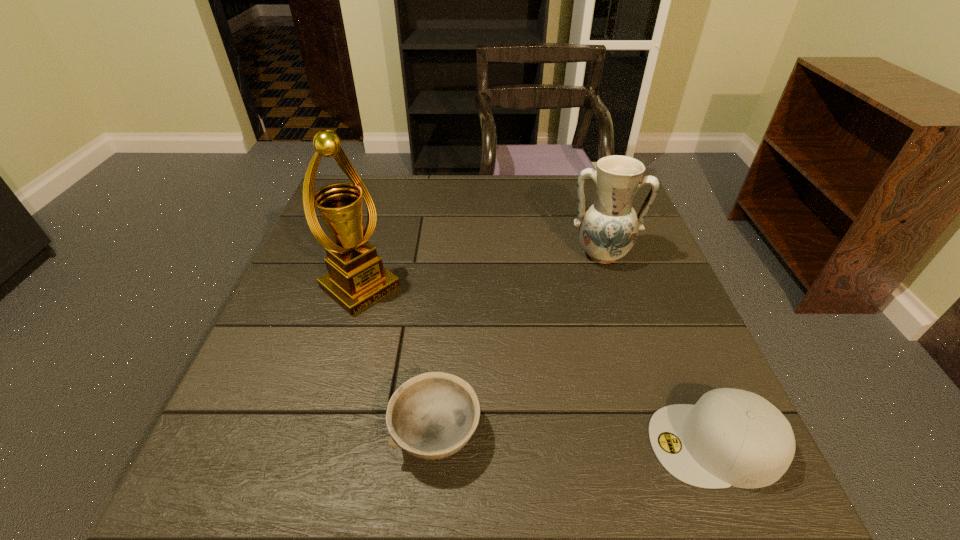
Find the location of a particular element. This screenshot has width=960, height=540. free location located 0.250m on either side of the second tallest object is located at coordinates (595, 349).

Locate an element on the screen. The image size is (960, 540). vacant region located 0.140m on either side of the second tallest object is located at coordinates (597, 312).

In order to click on vacant area located 0.120m on either side of the second tallest object in this screenshot , I will do `click(597, 306)`.

I want to click on free location located 0.330m on the front-facing side of the tallest object, so click(x=491, y=394).

I want to click on vacant space positioned on the front-facing side of the tallest object, so click(x=410, y=328).

This screenshot has height=540, width=960. I want to click on vacant area situated on the front-facing side of the tallest object, so click(x=483, y=388).

Locate an element on the screen. This screenshot has width=960, height=540. bowl that is at the near edge is located at coordinates (433, 415).

I want to click on cap present at the near edge, so click(731, 437).

You are a GUI agent. You are given a task and a screenshot of the screen. Output one action in this format:
    pyautogui.click(x=<x>, y=<y>)
    Task: Click on the object that is at the left edge
    
    Given the screenshot: What is the action you would take?
    pyautogui.click(x=356, y=279)

This screenshot has height=540, width=960. Find the location of `cap located at the right edge`. cap located at the right edge is located at coordinates (x=731, y=437).